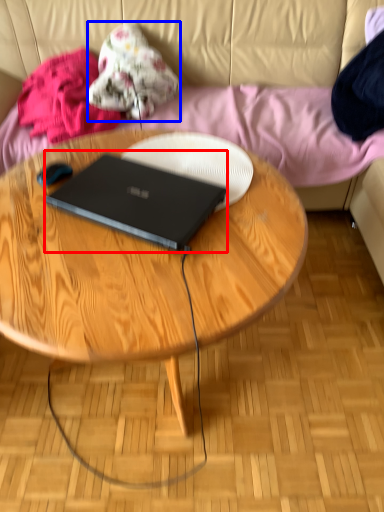
Question: Among these objects, which one is nearest to the camera, laptop (highlighted by a red box) or clothing (highlighted by a blue box)?

Choices:
 (A) laptop
 (B) clothing

Answer: (A)